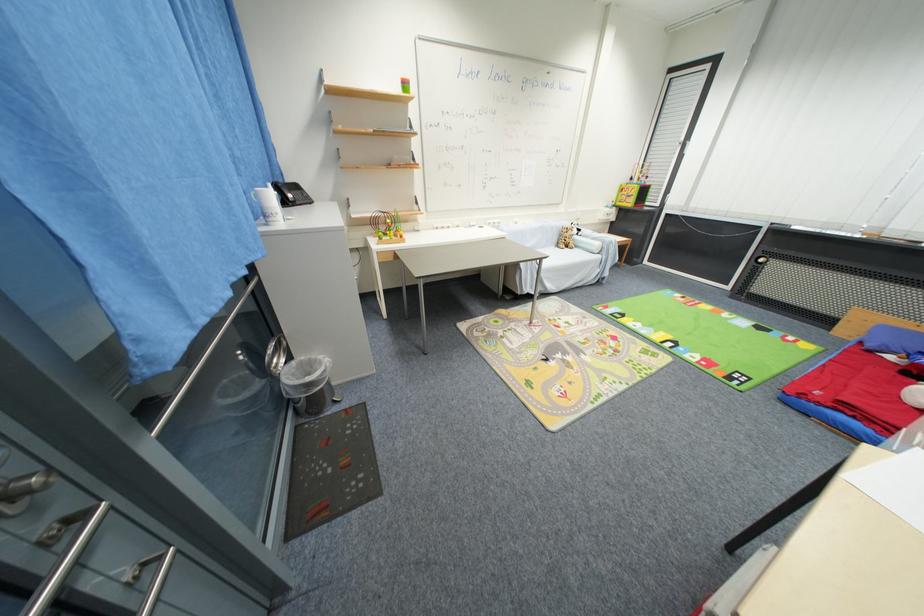
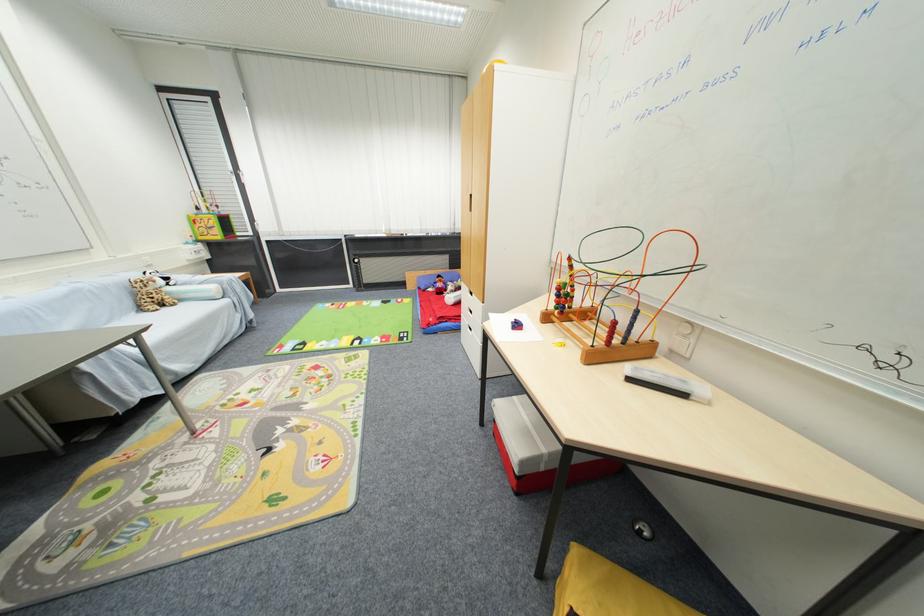
Find the pixel in the second image that matches [572,251] in the first image.

(171, 310)